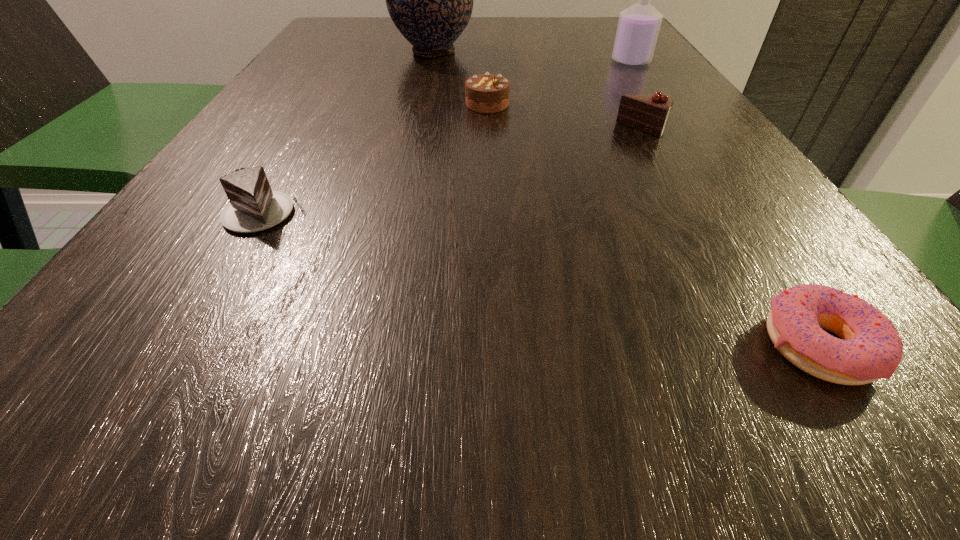
Where is `the tallest object`? the tallest object is located at coordinates (430, 0).

At what (x,y) coordinates should I click in order to perform the action: click on perfume. Please return your answer as a coordinate pair (x, y). The height and width of the screenshot is (540, 960). Looking at the image, I should click on (638, 27).

Where is `the farthest chocolate cake`? the farthest chocolate cake is located at coordinates (486, 93).

Locate an element on the screen. The height and width of the screenshot is (540, 960). the third farthest object is located at coordinates (486, 93).

Where is `the rightmost chocolate cake`? The width and height of the screenshot is (960, 540). the rightmost chocolate cake is located at coordinates (648, 113).

Locate an element on the screen. the third nearest object is located at coordinates (648, 113).

Locate an element on the screen. The image size is (960, 540). the leftmost object is located at coordinates (253, 206).

Image resolution: width=960 pixels, height=540 pixels. I want to click on the nearest chocolate cake, so click(253, 206).

What are the coordinates of `doughnut` in the screenshot? It's located at (870, 348).

The image size is (960, 540). Find the location of `the nearest object`. the nearest object is located at coordinates (870, 348).